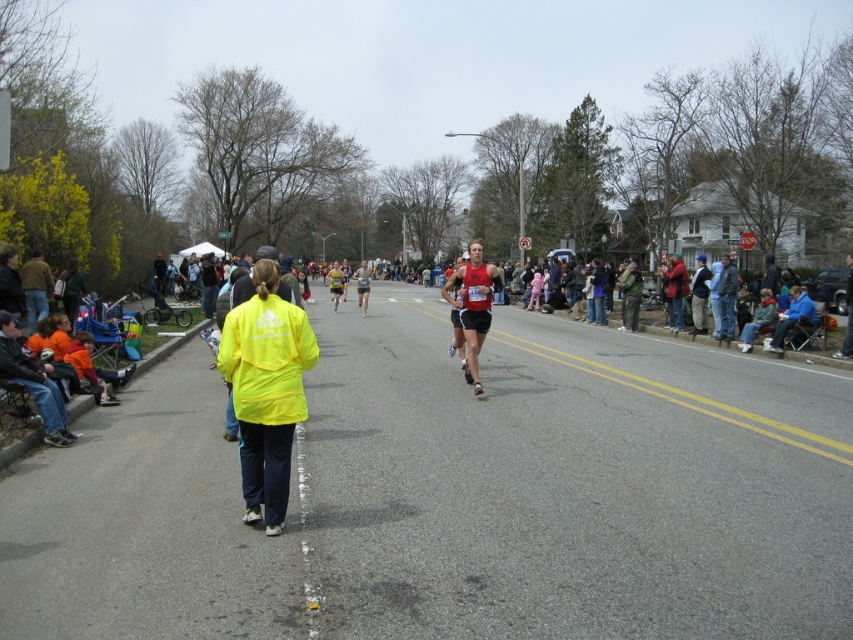
Looking at this image, who is shorter, yellow fabric jacket at center or yellow reflective jacket at center?

yellow fabric jacket at center

Is yellow fabric jacket at center above yellow reflective jacket at center?

Actually, yellow fabric jacket at center is below yellow reflective jacket at center.

Identify the location of yellow fabric jacket at center. (265, 388).

In the scene shown: Is red matte running suit at center smaller than matte running suit at center?

Indeed, red matte running suit at center has a smaller size compared to matte running suit at center.

Does red matte running suit at center have a lesser width compared to matte running suit at center?

Yes, red matte running suit at center is thinner than matte running suit at center.

Who is more forward, [480,241] or [363,288]?

Positioned in front is point [363,288].

Locate an element on the screen. The height and width of the screenshot is (640, 853). red matte running suit at center is located at coordinates (473, 305).

Looking at this image, which is more to the left, red matte running suit at center or yellow reflective jacket at center?

yellow reflective jacket at center is more to the left.

Can you confirm if red matte running suit at center is bigger than yellow reflective jacket at center?

Incorrect, red matte running suit at center is not larger than yellow reflective jacket at center.

Does point (457, 276) come closer to viewer compared to point (338, 285)?

Yes, it is in front of point (338, 285).

Find the location of a particular element. red matte running suit at center is located at coordinates (473, 305).